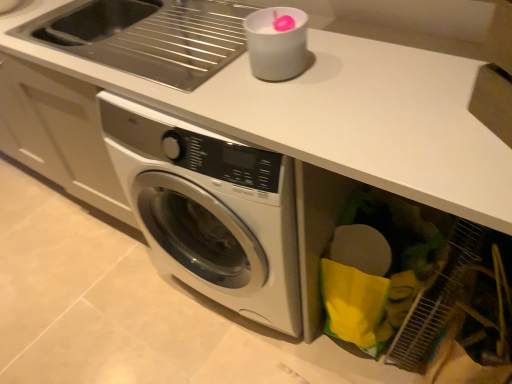
Question: Is white plastic cup at upper center taller or shorter than stainless steel sink at upper left?

Choices:
 (A) short
 (B) tall

Answer: (A)

Question: Considering the positions of white plastic cup at upper center and stainless steel sink at upper left in the image, is white plastic cup at upper center bigger or smaller than stainless steel sink at upper left?

Choices:
 (A) small
 (B) big

Answer: (A)

Question: Looking at their shapes, would you say white plastic cup at upper center is wider or thinner than stainless steel sink at upper left?

Choices:
 (A) thin
 (B) wide

Answer: (A)

Question: Is stainless steel sink at upper left taller or shorter than white plastic cup at upper center?

Choices:
 (A) tall
 (B) short

Answer: (A)

Question: Choose the correct answer: Is stainless steel sink at upper left inside white plastic cup at upper center or outside it?

Choices:
 (A) inside
 (B) outside

Answer: (B)

Question: Would you say stainless steel sink at upper left is to the left or to the right of white plastic cup at upper center in the picture?

Choices:
 (A) left
 (B) right

Answer: (A)

Question: Does point (97, 26) appear closer or farther from the camera than point (288, 72)?

Choices:
 (A) farther
 (B) closer

Answer: (A)